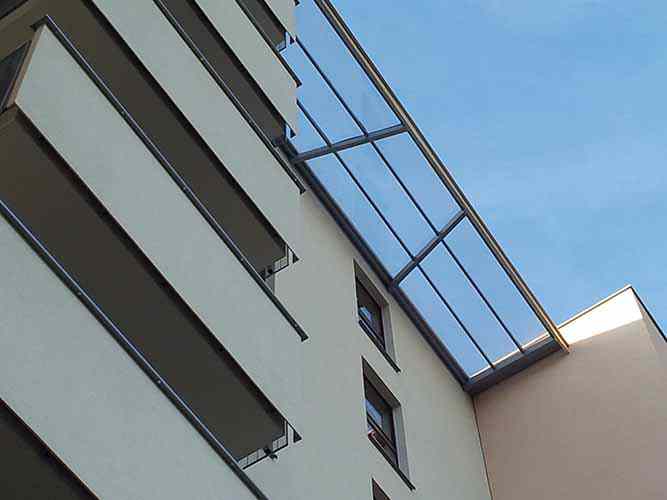
At what (x,y) coordinates should I click in order to perform the action: click on window ledges. Please return your answer as a coordinate pair (x, y). The width and height of the screenshot is (667, 500). Looking at the image, I should click on (370, 337), (392, 454).